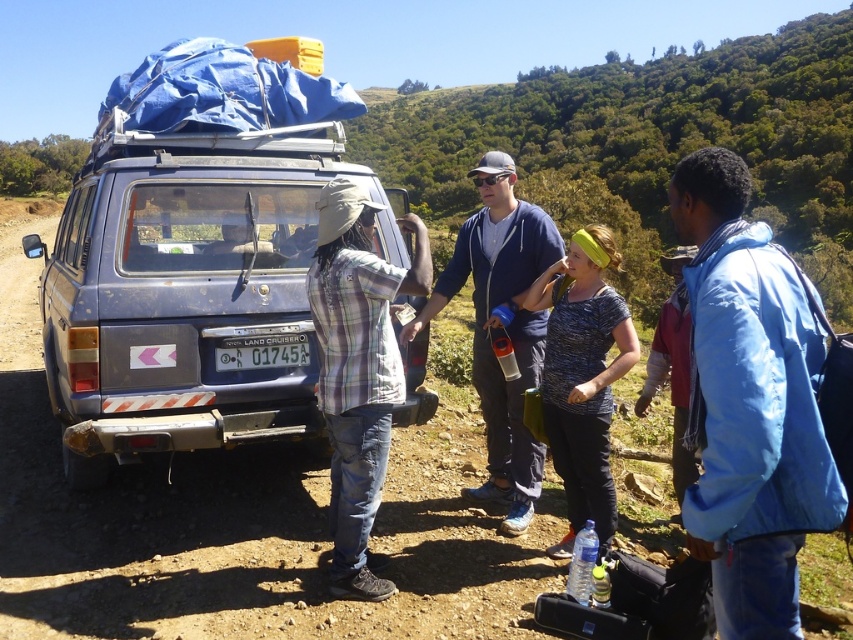
Question: Among these points, which one is nearest to the camera?

Choices:
 (A) (554, 416)
 (B) (469, 232)
 (C) (381, 464)

Answer: (C)

Question: Which of these objects is positioned farthest from the blue fabric jacket at right?

Choices:
 (A) matte blue minivan at center
 (B) blue cotton shirt at center

Answer: (A)

Question: In this image, where is blue cotton shirt at center located relative to printed cotton shirt at center?

Choices:
 (A) left
 (B) right

Answer: (A)

Question: Considering the relative positions of blue cotton shirt at center and printed cotton shirt at center in the image provided, where is blue cotton shirt at center located with respect to printed cotton shirt at center?

Choices:
 (A) below
 (B) above

Answer: (B)

Question: Can you confirm if blue cotton shirt at center is positioned to the right of white plastic license plate at center?

Choices:
 (A) no
 (B) yes

Answer: (B)

Question: Which point is farther to the camera?

Choices:
 (A) (267, 422)
 (B) (364, 352)
 (C) (514, 470)
 (D) (798, 394)

Answer: (C)